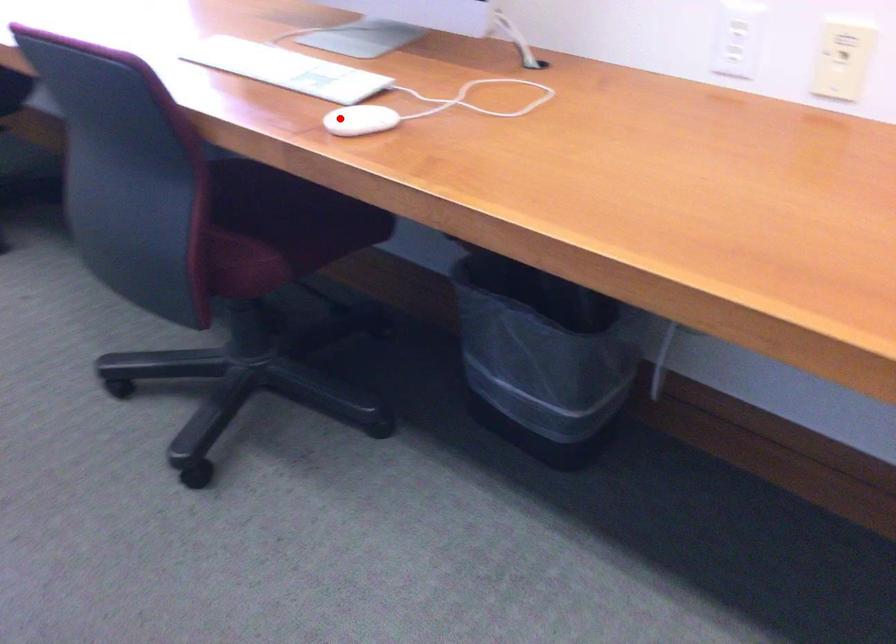
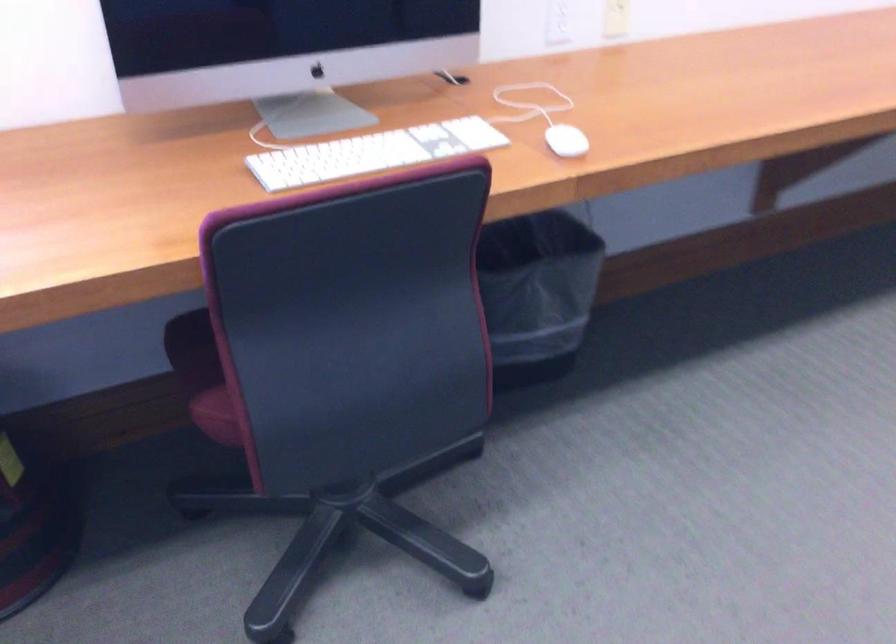
Question: I am providing you with two images of the same scene from different viewpoints. In image1, a red point is highlighted. Considering the same 3D point in image2, which of the following is correct?

Choices:
 (A) It is closer
 (B) It is farther

Answer: (B)